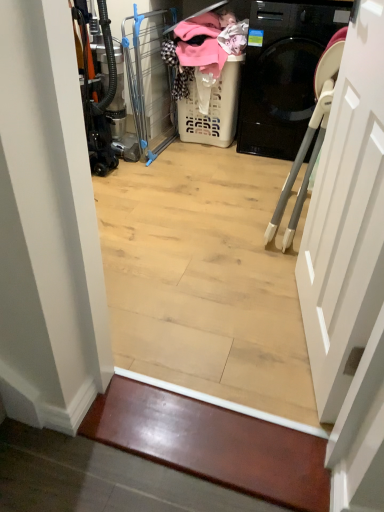
Question: Is white matte door at right in front of white plastic laundry basket at center?

Choices:
 (A) yes
 (B) no

Answer: (A)

Question: Are white matte door at right and white plastic laundry basket at center making contact?

Choices:
 (A) no
 (B) yes

Answer: (A)

Question: Can you confirm if white matte door at right is smaller than white plastic laundry basket at center?

Choices:
 (A) no
 (B) yes

Answer: (A)

Question: Is white plastic laundry basket at center at the back of white matte door at right?

Choices:
 (A) no
 (B) yes

Answer: (A)

Question: Is white matte door at right shorter than white plastic laundry basket at center?

Choices:
 (A) no
 (B) yes

Answer: (A)

Question: Based on their positions, is white plastic laundry basket at center located to the left or right of clear plastic screen door at center?

Choices:
 (A) right
 (B) left

Answer: (A)

Question: Is white plastic laundry basket at center spatially inside clear plastic screen door at center, or outside of it?

Choices:
 (A) outside
 (B) inside

Answer: (A)

Question: From a real-world perspective, relative to clear plastic screen door at center, is white plastic laundry basket at center vertically above or below?

Choices:
 (A) above
 (B) below

Answer: (B)

Question: From the image's perspective, is white plastic laundry basket at center above or below clear plastic screen door at center?

Choices:
 (A) below
 (B) above

Answer: (A)

Question: From the image's perspective, relative to white matte door at right, is white plastic laundry basket at center above or below?

Choices:
 (A) below
 (B) above

Answer: (B)

Question: Is point (188, 114) positioned closer to the camera than point (372, 242)?

Choices:
 (A) farther
 (B) closer

Answer: (A)

Question: Visually, is white plastic laundry basket at center positioned to the left or to the right of white matte door at right?

Choices:
 (A) left
 (B) right

Answer: (A)

Question: Is white plastic laundry basket at center wider or thinner than white matte door at right?

Choices:
 (A) thin
 (B) wide

Answer: (B)

Question: Considering the positions of white plastic laundry basket at center and shiny wood stair at lower center in the image, is white plastic laundry basket at center wider or thinner than shiny wood stair at lower center?

Choices:
 (A) wide
 (B) thin

Answer: (A)

Question: Is white plastic laundry basket at center in front of or behind shiny wood stair at lower center in the image?

Choices:
 (A) front
 (B) behind

Answer: (B)